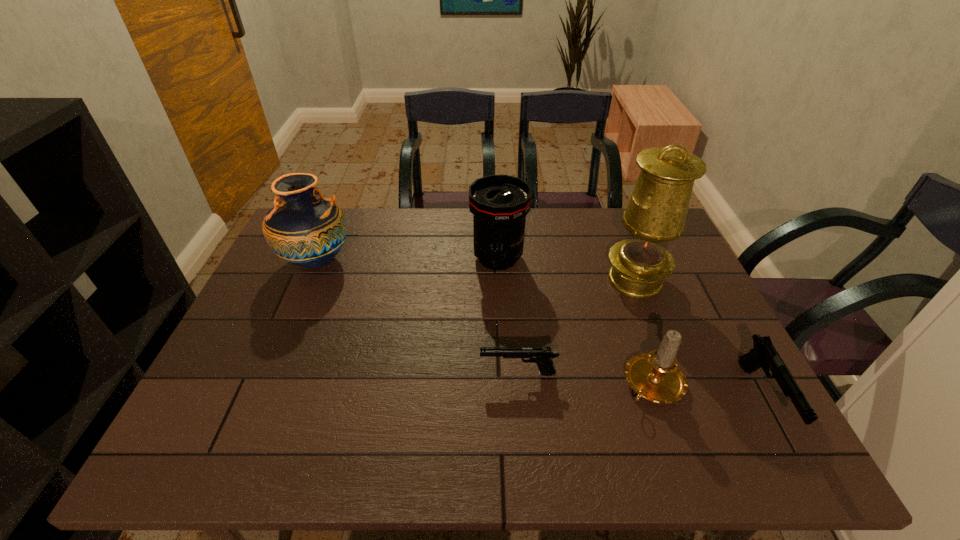
Where is `gun present at the right edge`? The image size is (960, 540). gun present at the right edge is located at coordinates (764, 354).

Where is `oil lamp present at the right edge`? The width and height of the screenshot is (960, 540). oil lamp present at the right edge is located at coordinates (655, 215).

You are a GUI agent. You are given a task and a screenshot of the screen. Output one action in this format:
    pyautogui.click(x=<x>, y=<y>)
    Task: Click on the candle that is positioned at the right edge
    
    Given the screenshot: What is the action you would take?
    pyautogui.click(x=655, y=376)

I want to click on object situated at the far left corner, so click(x=303, y=228).

Where is `gun located at the near right corner`? The image size is (960, 540). gun located at the near right corner is located at coordinates (764, 354).

This screenshot has width=960, height=540. What are the coordinates of `candle at the near right corner` in the screenshot? It's located at (655, 376).

Identify the location of free region at the far edge. (470, 241).

In the image, there is a desktop. Identify the location of vacant space at the left edge. (267, 359).

The height and width of the screenshot is (540, 960). What are the coordinates of `free space at the right edge of the desktop` in the screenshot? It's located at (679, 265).

Find the location of a particular element. free space between the right gun and the leftmost object is located at coordinates (540, 330).